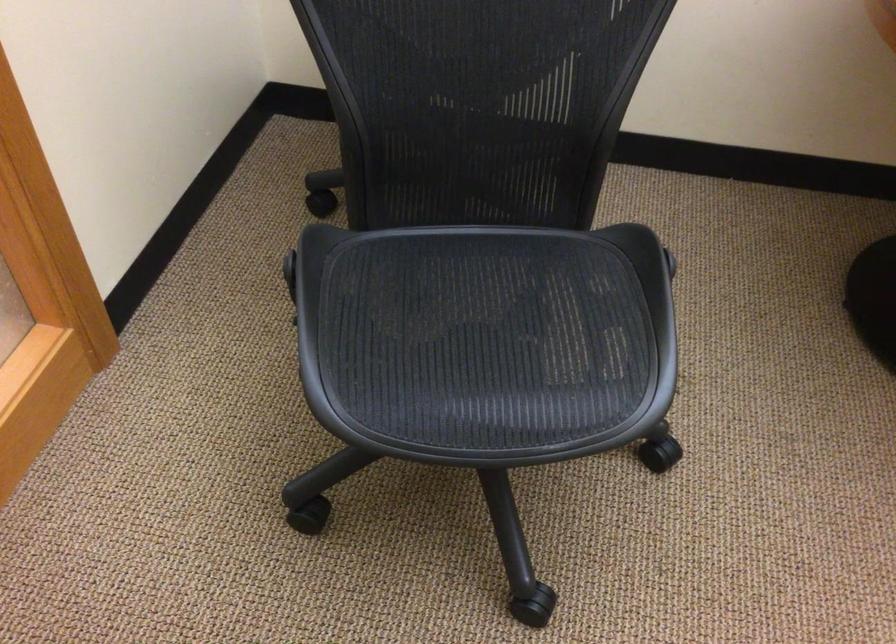
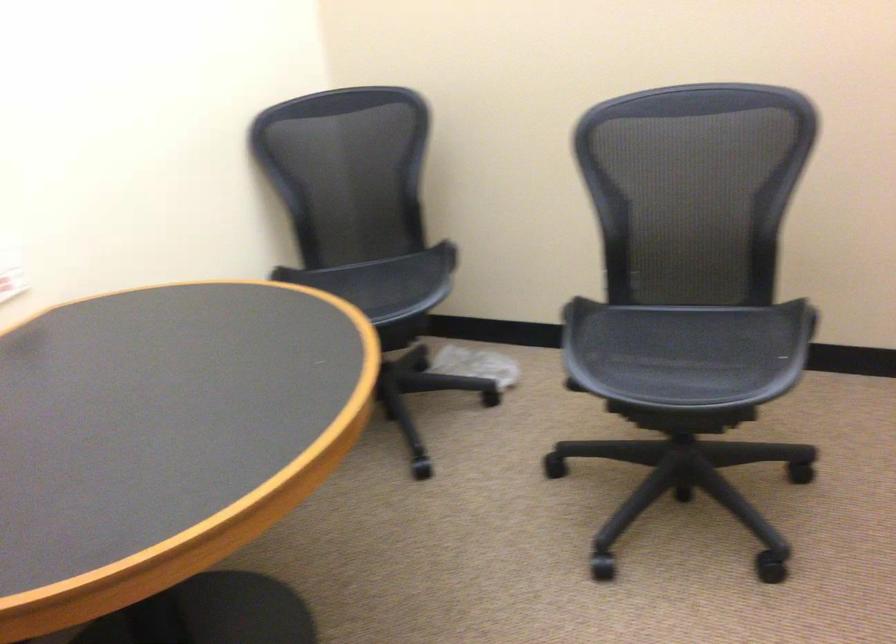
Question: Based on the continuous images, in which direction is the camera rotating? Reply with the corresponding letter.

Choices:
 (A) Left
 (B) Right
 (C) Up
 (D) Down

Answer: (B)